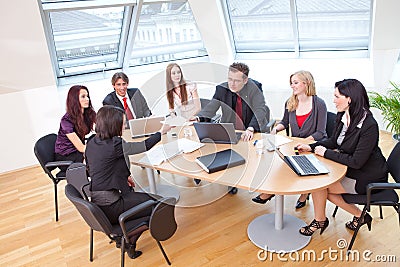
This screenshot has height=267, width=400. Identify the location of chair. (84, 211), (45, 152), (383, 198), (328, 118), (270, 121), (202, 100).